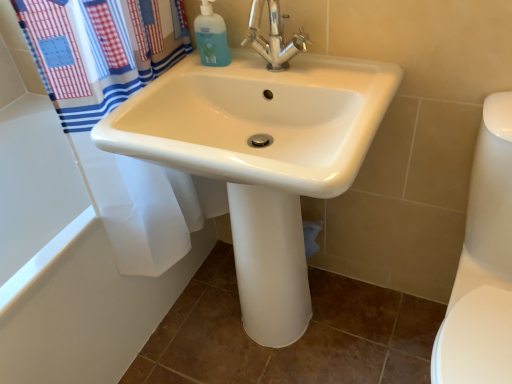
Where is `vacant area that lies in front of translucent plastic bottle at upper center`? The width and height of the screenshot is (512, 384). vacant area that lies in front of translucent plastic bottle at upper center is located at coordinates (210, 80).